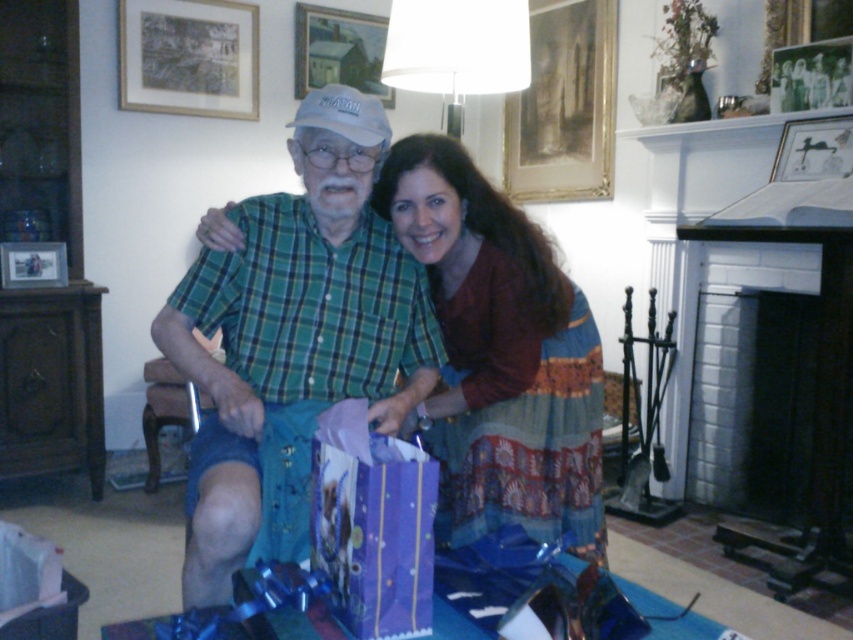
You are a photographer setting up for a group photo. The subjects are wearing a green plaid shirt at center and a maroon fabric dress at center. You need to position them so that there is at least 10 inches between them for proper framing. Based on the current distance, is their current spacing sufficient?

The green plaid shirt at center is 9.62 inches away from the maroon fabric dress at center. Since 9.62 inches is less than the required 10 inches, their current spacing is insufficient for proper framing.